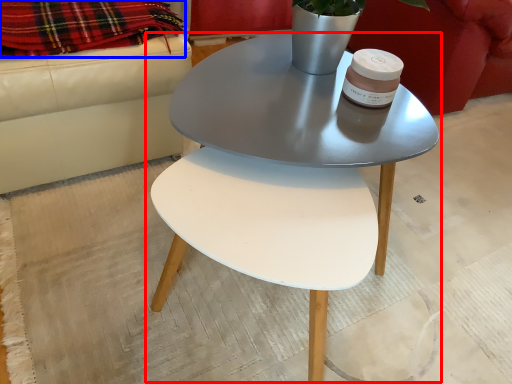
Question: Which object is further to the camera taking this photo, coffee table (highlighted by a red box) or blanket (highlighted by a blue box)?

Choices:
 (A) coffee table
 (B) blanket

Answer: (B)